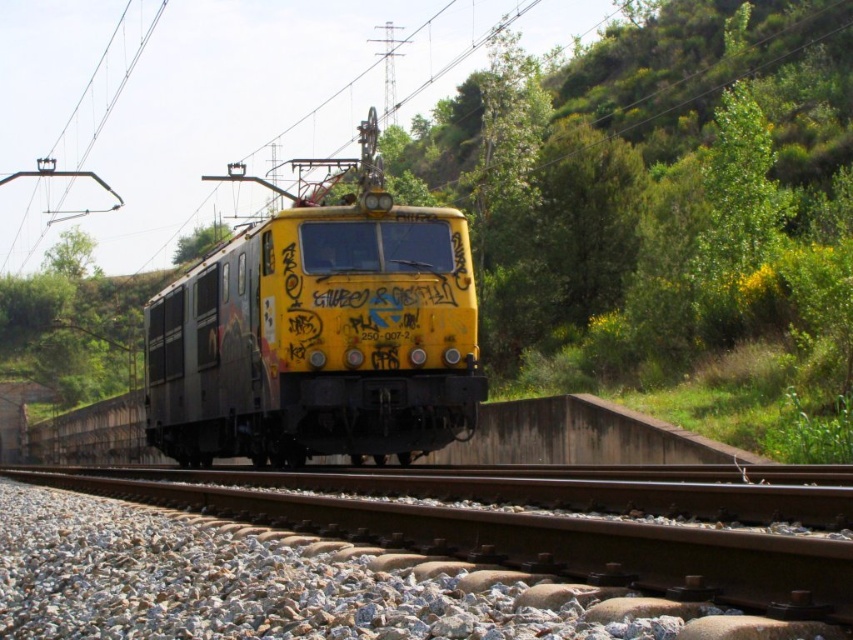
Question: Does gray gravel at bottom come in front of yellow matte train at center?

Choices:
 (A) yes
 (B) no

Answer: (A)

Question: Among these points, which one is nearest to the camera?

Choices:
 (A) (283, 394)
 (B) (727, 531)

Answer: (B)

Question: Where is gray gravel at bottom located in relation to yellow matte train at center in the image?

Choices:
 (A) left
 (B) right

Answer: (B)

Question: Does gray gravel at bottom have a greater width compared to yellow matte train at center?

Choices:
 (A) yes
 (B) no

Answer: (A)

Question: Which object appears farthest from the camera in this image?

Choices:
 (A) gray gravel at bottom
 (B) yellow matte train at center

Answer: (B)